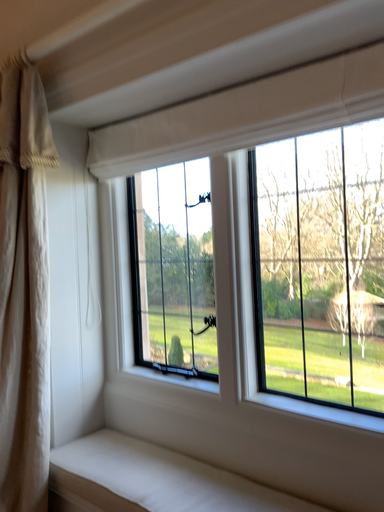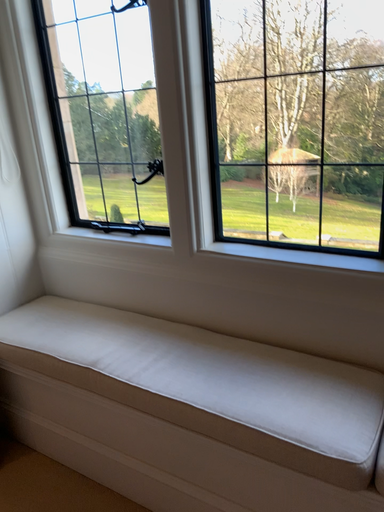
Question: How did the camera likely rotate when shooting the video?

Choices:
 (A) rotated left
 (B) rotated right

Answer: (B)